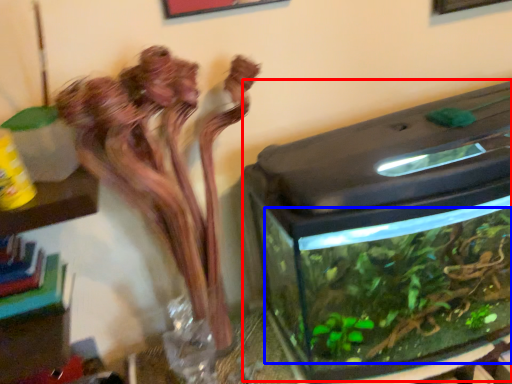
Question: Among these objects, which one is nearest to the camera, water tank (highlighted by a red box) or plant (highlighted by a blue box)?

Choices:
 (A) water tank
 (B) plant

Answer: (A)